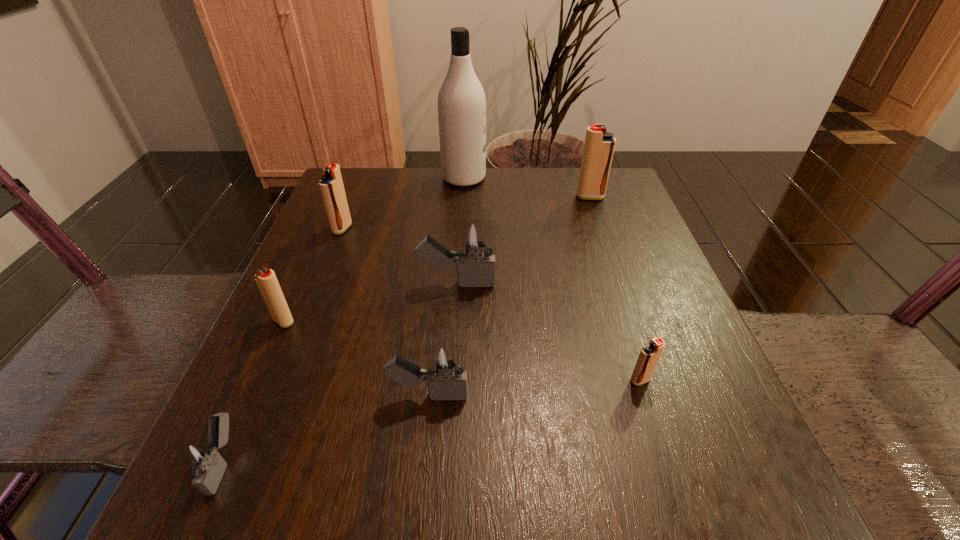
This screenshot has height=540, width=960. Find the location of `free space that is in between the tallest igniter and the third farthest igniter`. free space that is in between the tallest igniter and the third farthest igniter is located at coordinates (523, 240).

Where is `unoccupied area between the farthest igniter and the second smallest gray igniter`? Image resolution: width=960 pixels, height=540 pixels. unoccupied area between the farthest igniter and the second smallest gray igniter is located at coordinates (509, 296).

Point out which object is positioned as the seventh nearest to the nearest igniter. Please provide its 2D coordinates. Your answer should be formatted as a tuple, i.e. [(x, y)], where the tuple contains the x and y coordinates of a point satisfying the conditions above.

[(599, 146)]

Identify the location of the closest object relative to the nearest red igniter. The height and width of the screenshot is (540, 960). (445, 371).

You are a GUI agent. You are given a task and a screenshot of the screen. Output one action in this format:
    pyautogui.click(x=<x>, y=<y>)
    Task: Click on the sixth closest igniter to the nearest red igniter
    Image resolution: width=960 pixels, height=540 pixels.
    Given the screenshot: What is the action you would take?
    pyautogui.click(x=331, y=185)

Identify which igniter is the fourth nearest to the second farthest igniter. Please provide its 2D coordinates. Your answer should be formatted as a tuple, i.e. [(x, y)], where the tuple contains the x and y coordinates of a point satisfying the conditions above.

[(201, 461)]

What are the coordinates of `the second closest red igniter relative to the biggest red igniter` in the screenshot? It's located at (331, 185).

What are the coordinates of `red igniter that is the third nearest to the smallest red igniter` in the screenshot? It's located at (331, 185).

Locate which gray igniter ranks third in proximity to the second biggest red igniter. Please provide its 2D coordinates. Your answer should be formatted as a tuple, i.e. [(x, y)], where the tuple contains the x and y coordinates of a point satisfying the conditions above.

[(201, 461)]

The image size is (960, 540). In order to click on gray igniter that can be found as the closest to the second nearest gray igniter in this screenshot , I will do `click(477, 238)`.